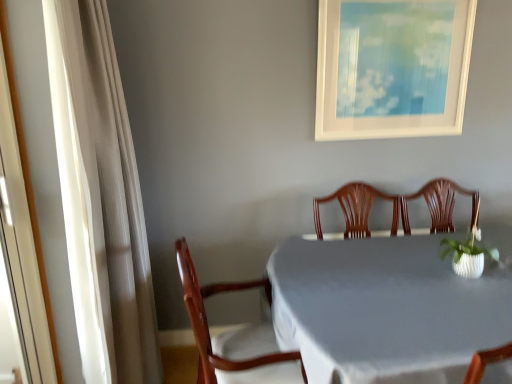
Question: From the image's perspective, is white glossy screen door at left located beneath wooden chair at center?

Choices:
 (A) no
 (B) yes

Answer: (A)

Question: Is white glossy screen door at left positioned in front of wooden chair at center?

Choices:
 (A) no
 (B) yes

Answer: (B)

Question: Does white glossy screen door at left have a lesser height compared to wooden chair at center?

Choices:
 (A) yes
 (B) no

Answer: (B)

Question: Does white glossy screen door at left have a greater height compared to wooden chair at center?

Choices:
 (A) yes
 (B) no

Answer: (A)

Question: Would you consider white glossy screen door at left to be distant from wooden chair at center?

Choices:
 (A) no
 (B) yes

Answer: (A)

Question: Is white glossy screen door at left turned away from wooden chair at center?

Choices:
 (A) no
 (B) yes

Answer: (A)

Question: Would you say white glossy screen door at left is part of white matte picture frame at upper center's contents?

Choices:
 (A) yes
 (B) no

Answer: (B)

Question: Can we say white matte picture frame at upper center lies outside white glossy screen door at left?

Choices:
 (A) yes
 (B) no

Answer: (A)

Question: Is white matte picture frame at upper center aimed at white glossy screen door at left?

Choices:
 (A) yes
 (B) no

Answer: (B)

Question: Does white matte picture frame at upper center have a greater height compared to white glossy screen door at left?

Choices:
 (A) yes
 (B) no

Answer: (B)

Question: Is white matte picture frame at upper center smaller than white glossy screen door at left?

Choices:
 (A) yes
 (B) no

Answer: (A)

Question: From a real-world perspective, is white matte picture frame at upper center on white glossy screen door at left?

Choices:
 (A) no
 (B) yes

Answer: (B)

Question: Does wooden chair at center appear on the left side of white cloth-covered table at center?

Choices:
 (A) no
 (B) yes

Answer: (B)